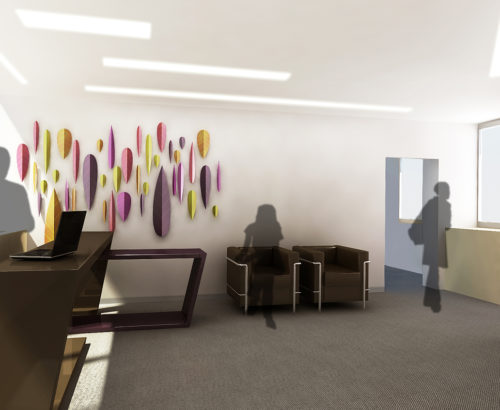
The height and width of the screenshot is (410, 500). Find the location of `back of laptop screen`. back of laptop screen is located at coordinates [68, 230].